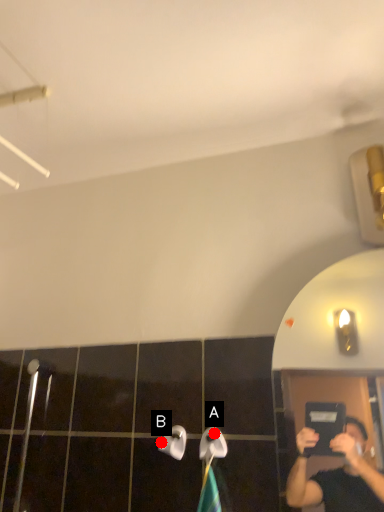
Question: Two points are circled on the image, labeled by A and B beside each circle. Which point appears farthest from the camera in this image?

Choices:
 (A) A is further
 (B) B is further

Answer: (B)